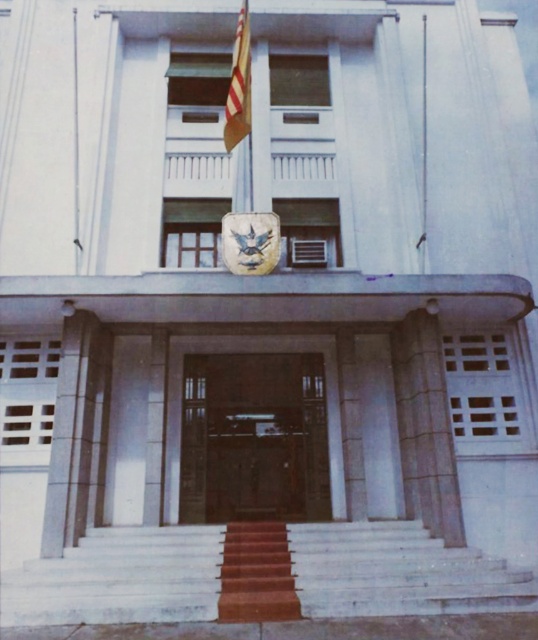
Question: Which object is closer to the camera taking this photo?

Choices:
 (A) striped fabric flag at upper center
 (B) rustic wooden stairs at center

Answer: (B)

Question: Which point is closer to the camera?

Choices:
 (A) (424, 61)
 (B) (201, 444)
 (C) (288, 611)
 (D) (247, 68)

Answer: (C)

Question: Can you confirm if rustic wooden stairs at center is smaller than striped fabric flag at upper center?

Choices:
 (A) no
 (B) yes

Answer: (B)

Question: Is brown wooden door at center to the right of striped fabric flag at upper center from the viewer's perspective?

Choices:
 (A) no
 (B) yes

Answer: (B)

Question: Which object appears farthest from the camera in this image?

Choices:
 (A) striped fabric flag at upper center
 (B) metallic flag pole at center
 (C) maroon carpeted stairs at center
 (D) brown wooden door at center

Answer: (B)

Question: Is brown wooden door at center wider than metallic flag pole at center?

Choices:
 (A) yes
 (B) no

Answer: (A)